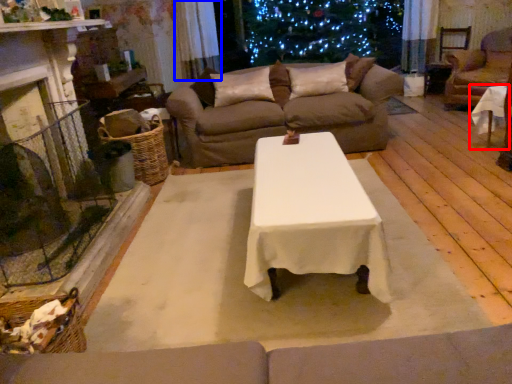
Question: Which object appears closest to the camera in this image, table (highlighted by a red box) or curtain (highlighted by a blue box)?

Choices:
 (A) table
 (B) curtain

Answer: (A)